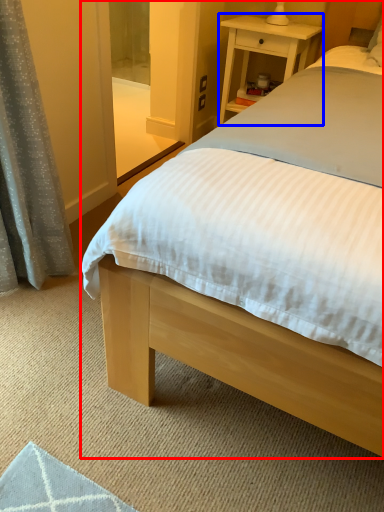
Question: Which object is closer to the camera taking this photo, bed (highlighted by a red box) or nightstand (highlighted by a blue box)?

Choices:
 (A) bed
 (B) nightstand

Answer: (A)